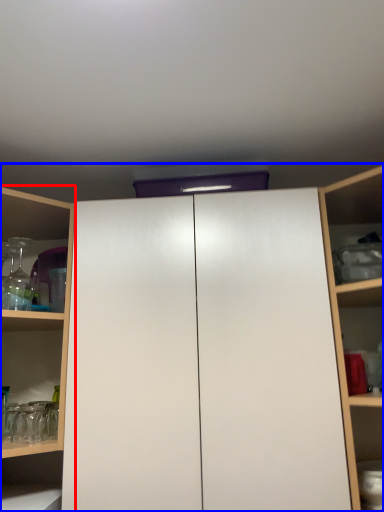
Question: Which of the following is the farthest to the observer, shelf (highlighted by a red box) or cupboard (highlighted by a blue box)?

Choices:
 (A) shelf
 (B) cupboard

Answer: (A)